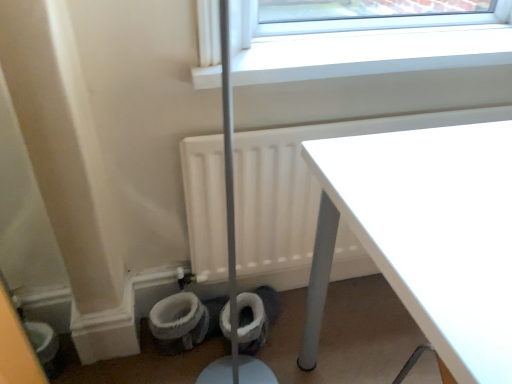
Question: Does point (364, 223) appear closer or farther from the camera than point (219, 87)?

Choices:
 (A) farther
 (B) closer

Answer: (B)

Question: In the image, is white glossy table at upper right on the left side or the right side of white plastic window sill at upper center?

Choices:
 (A) left
 (B) right

Answer: (B)

Question: Which object is positioned farthest from the white matte radiator at lower left?

Choices:
 (A) white glossy table at upper right
 (B) white fabric toilet bowl at lower left
 (C) white plastic window sill at upper center
 (D) white fluffy toilet paper at lower center

Answer: (B)

Question: Based on their relative distances, which object is farther from the white glossy table at upper right?

Choices:
 (A) white fluffy toilet paper at lower center
 (B) white plastic window sill at upper center
 (C) white fabric toilet bowl at lower left
 (D) white matte radiator at lower left

Answer: (C)